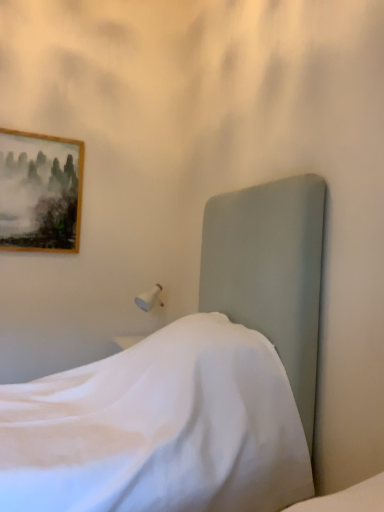
Question: Considering the positions of wooden framed painting at upper left and satin white bed at center in the image, is wooden framed painting at upper left taller or shorter than satin white bed at center?

Choices:
 (A) short
 (B) tall

Answer: (A)

Question: Based on their sizes in the image, would you say wooden framed painting at upper left is bigger or smaller than satin white bed at center?

Choices:
 (A) small
 (B) big

Answer: (A)

Question: From a real-world perspective, is wooden framed painting at upper left physically located above or below satin white bed at center?

Choices:
 (A) below
 (B) above

Answer: (B)

Question: In terms of size, does satin white bed at center appear bigger or smaller than wooden framed painting at upper left?

Choices:
 (A) small
 (B) big

Answer: (B)

Question: Would you say satin white bed at center is to the left or to the right of wooden framed painting at upper left in the picture?

Choices:
 (A) right
 (B) left

Answer: (A)

Question: From a real-world perspective, is satin white bed at center physically located above or below wooden framed painting at upper left?

Choices:
 (A) below
 (B) above

Answer: (A)

Question: Relative to wooden framed painting at upper left, is satin white bed at center in front or behind?

Choices:
 (A) behind
 (B) front

Answer: (B)